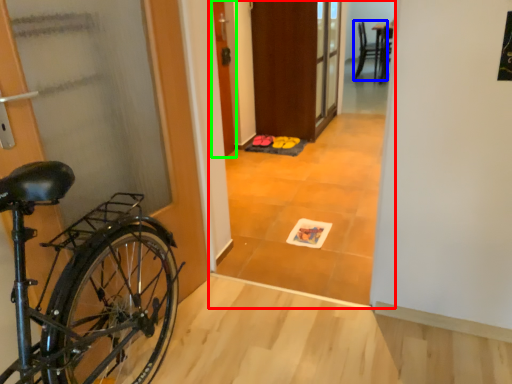
Question: Which object is the closest to the corridor (highlighted by a red box)? Choose among these: chair (highlighted by a blue box) or door (highlighted by a green box).

Choices:
 (A) chair
 (B) door

Answer: (B)